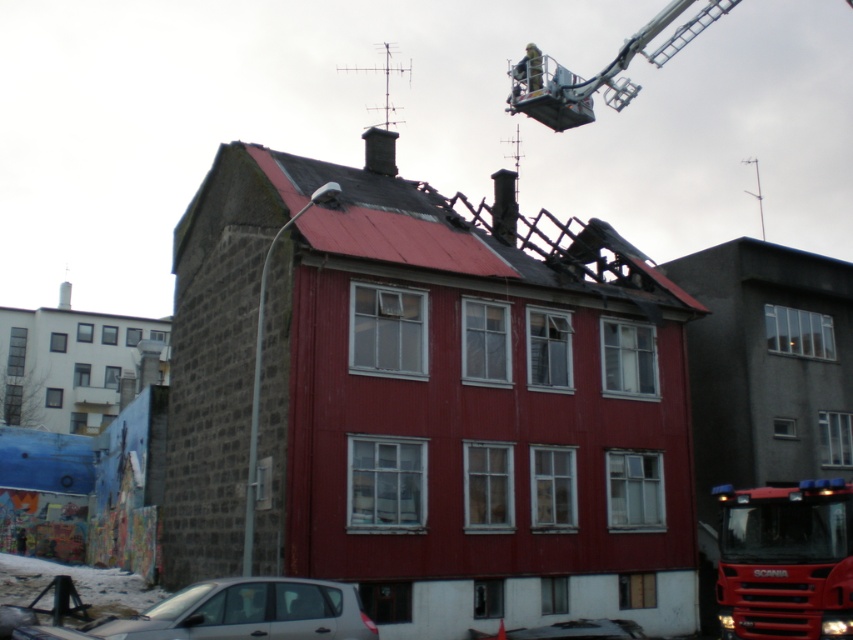
You are a construction worker assessing the damage to the building. You need to position a crane to lift debris away from the metallic silver crane at upper center and the smooth stone chimney at upper center. Given that the crane has a maximum reach of 120 feet, will it be able to safely lift debris between these two objects?

The metallic silver crane at upper center and the smooth stone chimney at upper center are 133.19 feet apart. Since the crane has a maximum reach of 120 feet, it will not be able to safely lift debris between these two objects as the distance exceeds its operational range.

Looking at this image, you are a drone operator trying to capture a photo of the damaged building. The silver metallic car at lower left is blocking your view. Can you adjust your position to avoid the car while still capturing the entire building?

The silver metallic car at lower left is positioned at coordinates (x=235, y=612). By adjusting the drone to the left or right of this point, you can avoid the car while still capturing the entire building in the frame.

Looking at this image, you are a delivery driver who needs to exit the area quickly. You see the silver metallic car at lower left and the metallic silver crane at upper center. Which vehicle should you prioritize moving away from first?

You should prioritize moving the silver metallic car at lower left first because it is closer to you than the metallic silver crane at upper center, so it poses a more immediate obstruction.